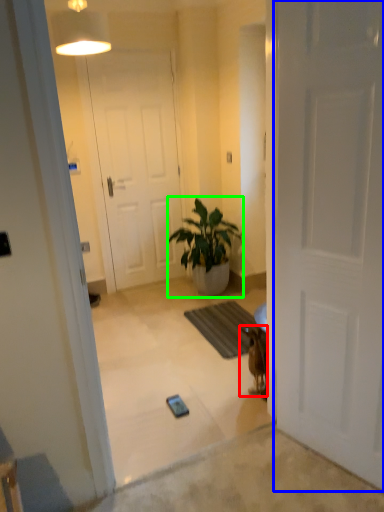
Question: Considering the real-world distances, which object is closest to animal (highlighted by a red box)? door (highlighted by a blue box) or houseplant (highlighted by a green box).

Choices:
 (A) door
 (B) houseplant

Answer: (A)